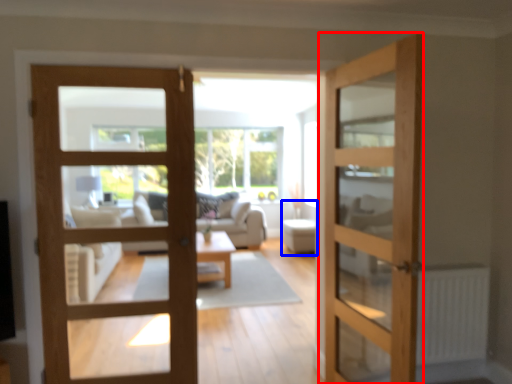
Question: Among these objects, which one is nearest to the camera, door (highlighted by a red box) or furniture (highlighted by a blue box)?

Choices:
 (A) door
 (B) furniture

Answer: (A)